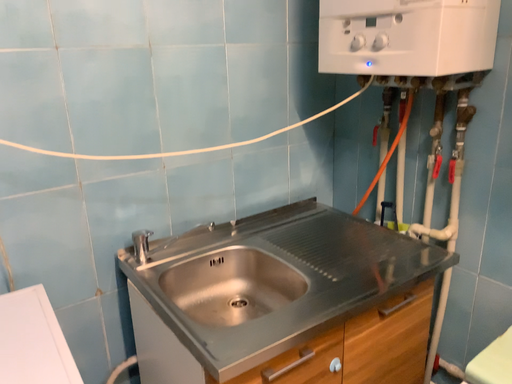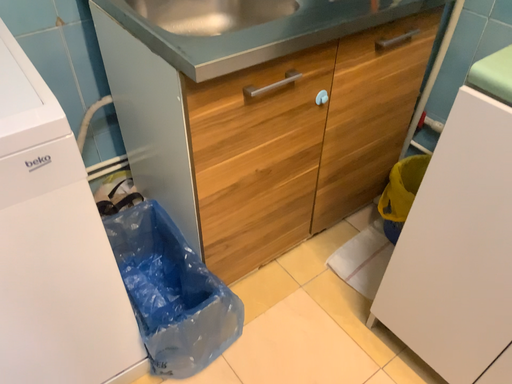
Question: Which way did the camera rotate in the video?

Choices:
 (A) rotated upward
 (B) rotated downward

Answer: (B)